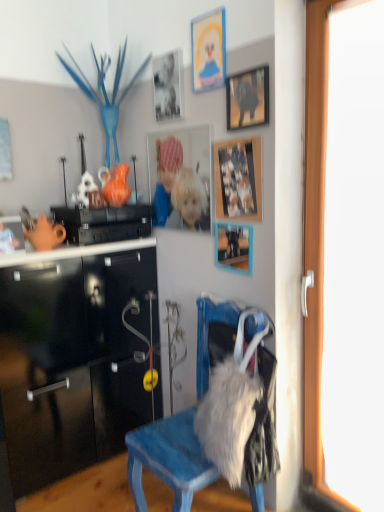
Question: Are black glossy cabinet at upper left and matte cardboard picture frame at upper center, arranged as the sixth picture frame when ordered from the bottom, beside each other?

Choices:
 (A) yes
 (B) no

Answer: (B)

Question: Is black glossy cabinet at upper left thinner than matte cardboard picture frame at upper center, arranged as the 1th picture frame when viewed from the top?

Choices:
 (A) no
 (B) yes

Answer: (A)

Question: Does black glossy cabinet at upper left have a greater height compared to matte cardboard picture frame at upper center, arranged as the 1th picture frame when viewed from the top?

Choices:
 (A) no
 (B) yes

Answer: (A)

Question: Is black glossy cabinet at upper left oriented away from matte cardboard picture frame at upper center, arranged as the 1th picture frame when viewed from the top?

Choices:
 (A) no
 (B) yes

Answer: (A)

Question: Would you say matte cardboard picture frame at upper center, arranged as the sixth picture frame when ordered from the bottom, is part of black glossy cabinet at upper left's contents?

Choices:
 (A) no
 (B) yes

Answer: (A)

Question: From the image's perspective, is blue painted wood chair at center located above or below wooden photo frame at upper center, the second picture frame when ordered from bottom to top?

Choices:
 (A) below
 (B) above

Answer: (A)

Question: Considering the positions of blue painted wood chair at center and wooden photo frame at upper center, which is the 5th picture frame in top-to-bottom order, in the image, is blue painted wood chair at center taller or shorter than wooden photo frame at upper center, which is the 5th picture frame in top-to-bottom order,?

Choices:
 (A) short
 (B) tall

Answer: (B)

Question: Is blue painted wood chair at center bigger or smaller than wooden photo frame at upper center, which is the 5th picture frame in top-to-bottom order?

Choices:
 (A) small
 (B) big

Answer: (B)

Question: In terms of width, does blue painted wood chair at center look wider or thinner when compared to wooden photo frame at upper center, the second picture frame when ordered from bottom to top?

Choices:
 (A) thin
 (B) wide

Answer: (B)

Question: Looking at their shapes, would you say black glossy cabinet at upper left is wider or thinner than transparent glass door at right?

Choices:
 (A) thin
 (B) wide

Answer: (B)

Question: Based on their sizes in the image, would you say black glossy cabinet at upper left is bigger or smaller than transparent glass door at right?

Choices:
 (A) big
 (B) small

Answer: (B)

Question: Would you say black glossy cabinet at upper left is inside or outside transparent glass door at right?

Choices:
 (A) outside
 (B) inside

Answer: (A)

Question: Is black glossy cabinet at upper left in front of or behind transparent glass door at right in the image?

Choices:
 (A) front
 (B) behind

Answer: (B)

Question: Considering the relative positions of matte plastic picture frame at center, the 3th picture frame positioned from the bottom, and matte black picture frame at center, positioned as the 6th picture frame in top-to-bottom order, in the image provided, is matte plastic picture frame at center, the 3th picture frame positioned from the bottom, to the left or to the right of matte black picture frame at center, positioned as the 6th picture frame in top-to-bottom order,?

Choices:
 (A) right
 (B) left

Answer: (B)

Question: Is matte plastic picture frame at center, the 3th picture frame positioned from the bottom, bigger or smaller than matte black picture frame at center, placed as the first picture frame when sorted from bottom to top?

Choices:
 (A) small
 (B) big

Answer: (B)